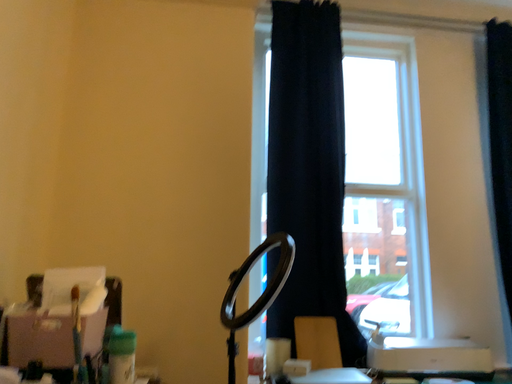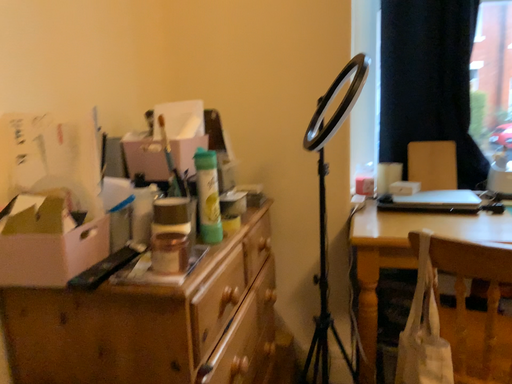
Question: Which way did the camera rotate in the video?

Choices:
 (A) rotated upward
 (B) rotated downward

Answer: (B)